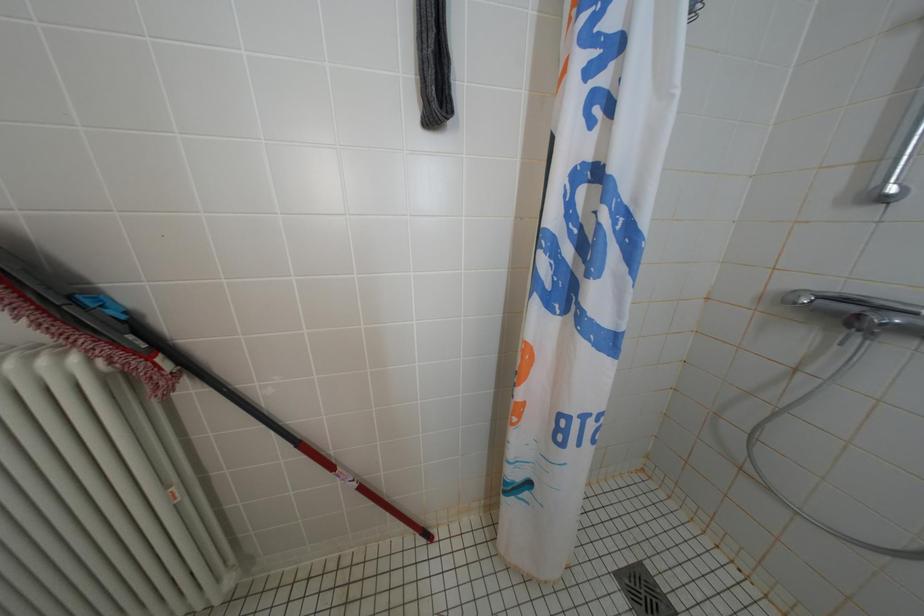
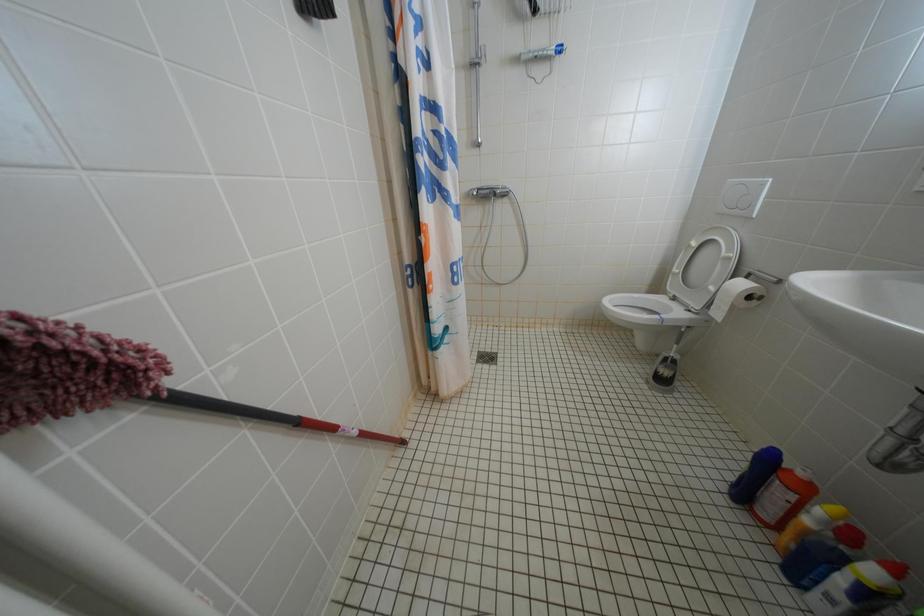
The images are taken continuously from a first-person perspective. In which direction is your viewpoint rotating?

The camera rotated toward right-down.